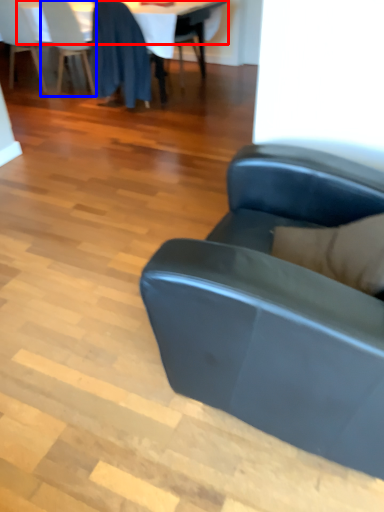
Question: Which object appears farthest to the camera in this image, table top (highlighted by a red box) or chair (highlighted by a blue box)?

Choices:
 (A) table top
 (B) chair

Answer: (B)